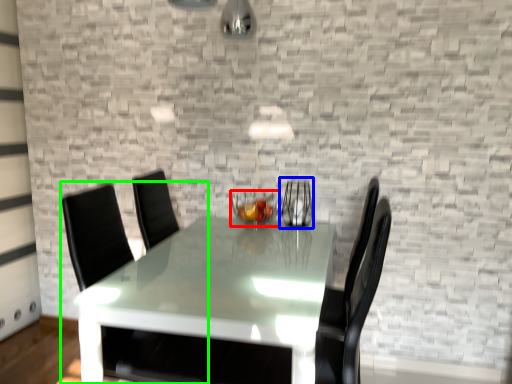
Question: Based on their relative distances, which object is farther from candle holder (highlighted by a red box)? Choose from glass vase (highlighted by a blue box) and swivel chair (highlighted by a green box).

Choices:
 (A) glass vase
 (B) swivel chair

Answer: (B)